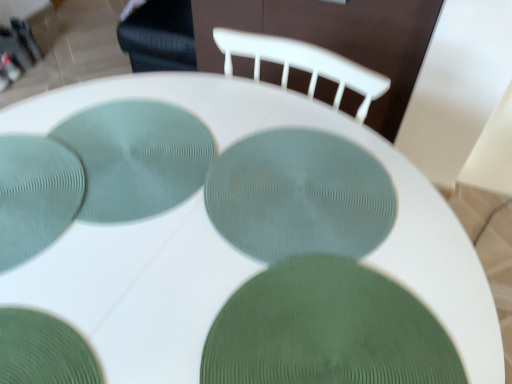
What are the coordinates of `vacant area situated below green textured plate at center, the 5th glass plate positioned from the left (from a real-world perspective)` in the screenshot? It's located at (337, 333).